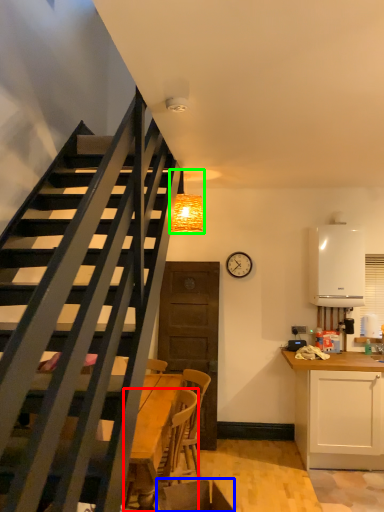
Question: Which is farther away from chair (highlighted by a red box)? swivel chair (highlighted by a blue box) or light fixture (highlighted by a green box)?

Choices:
 (A) swivel chair
 (B) light fixture

Answer: (B)